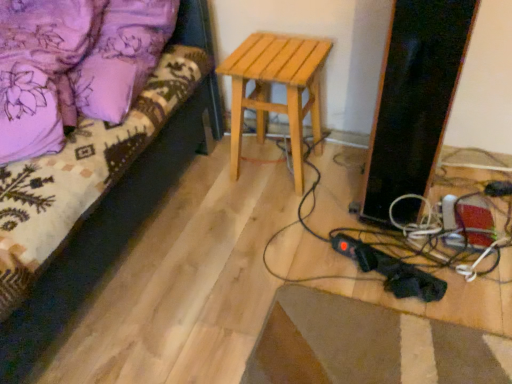
Locate an element on the screen. free point in front of light brown wooden stool at center is located at coordinates (285, 213).